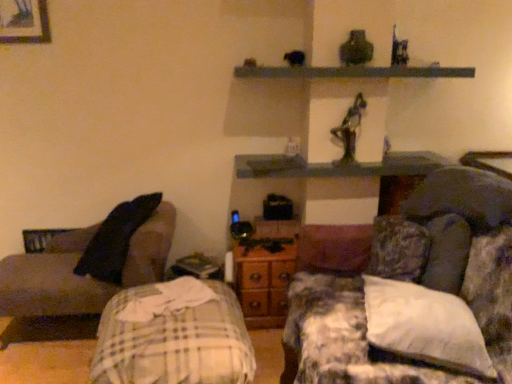
The image size is (512, 384). What do you see at coordinates (459, 247) in the screenshot?
I see `fluffy fabric couch at right, arranged as the 1th studio couch when viewed from the right` at bounding box center [459, 247].

The width and height of the screenshot is (512, 384). Describe the element at coordinates (173, 336) in the screenshot. I see `plaid fabric bed at lower left` at that location.

What is the approximate width of white soft pillow at right?

white soft pillow at right is 18.40 inches wide.

At what (x,y) coordinates should I click in order to perform the action: click on smooth gray shelf at upper center, which is the second shelf from bottom to top. Please return your answer as a coordinate pair (x, y). The height and width of the screenshot is (384, 512). Looking at the image, I should click on (352, 72).

Locate an element on the screen. wooden dresser at center is located at coordinates (265, 271).

Measure the distance between point (425, 157) and camera.

A distance of 2.70 meters exists between point (425, 157) and camera.

Identify the location of dark gray fabric couch at left, which is counted as the 2th studio couch, starting from the right. The image size is (512, 384). (79, 276).

In order to click on fluffy fabric couch at right, arranged as the 2th studio couch when viewed from the left in this screenshot , I will do `click(459, 247)`.

Where is `dresser on the left side of fluffy fabric couch at right, arranged as the 1th studio couch when viewed from the right`? This screenshot has width=512, height=384. dresser on the left side of fluffy fabric couch at right, arranged as the 1th studio couch when viewed from the right is located at coordinates (265, 271).

From the image's perspective, relative to wooden dresser at center, is fluffy fabric couch at right, arranged as the 1th studio couch when viewed from the right, above or below?

fluffy fabric couch at right, arranged as the 1th studio couch when viewed from the right, is situated lower than wooden dresser at center in the image.

Considering the sizes of objects fluffy fabric couch at right, arranged as the 2th studio couch when viewed from the left, and wooden dresser at center in the image provided, who is wider, fluffy fabric couch at right, arranged as the 2th studio couch when viewed from the left, or wooden dresser at center?

Wider between the two is fluffy fabric couch at right, arranged as the 2th studio couch when viewed from the left.

From a real-world perspective, between fluffy fabric couch at right, arranged as the 1th studio couch when viewed from the right, and wooden dresser at center, who is vertically lower?

wooden dresser at center is physically lower.

Based on their positions, is wooden shelf at center, acting as the 1th shelf starting from the bottom, located to the left or right of white soft pillow at right?

Based on their positions, wooden shelf at center, acting as the 1th shelf starting from the bottom, is located to the left of white soft pillow at right.

How different are the orientations of wooden shelf at center, acting as the 1th shelf starting from the bottom, and white soft pillow at right in degrees?

106 degrees.

Between wooden shelf at center, the 2th shelf viewed from the top, and white soft pillow at right, which one has more height?

Standing taller between the two is white soft pillow at right.

Which of these two, wooden shelf at center, acting as the 1th shelf starting from the bottom, or white soft pillow at right, is wider?

white soft pillow at right is wider.

Does fluffy fabric couch at right, arranged as the 1th studio couch when viewed from the right, have a larger size compared to wooden shelf at center, the 2th shelf viewed from the top?

Yes.

Which is farther from the camera, (337, 334) or (313, 171)?

Positioned behind is point (313, 171).

From a real-world perspective, is fluffy fabric couch at right, arranged as the 2th studio couch when viewed from the left, positioned above or below wooden shelf at center, the 2th shelf viewed from the top?

Clearly, from a real-world perspective, fluffy fabric couch at right, arranged as the 2th studio couch when viewed from the left, is below wooden shelf at center, the 2th shelf viewed from the top.

In the image, is wooden framed picture at upper left on the left side or the right side of plaid fabric bed at lower left?

wooden framed picture at upper left is to the left of plaid fabric bed at lower left.

Can you confirm if wooden framed picture at upper left is wider than plaid fabric bed at lower left?

No, wooden framed picture at upper left is not wider than plaid fabric bed at lower left.

Which object is closer to the camera, wooden framed picture at upper left or plaid fabric bed at lower left?

plaid fabric bed at lower left is closer to the camera.

Does smooth gray shelf at upper center, which is the second shelf from bottom to top, have a lesser height compared to plaid fabric bed at lower left?

Correct, smooth gray shelf at upper center, which is the second shelf from bottom to top, is not as tall as plaid fabric bed at lower left.

From the picture: Which object is thinner, smooth gray shelf at upper center, which is the second shelf from bottom to top, or plaid fabric bed at lower left?

With smaller width is smooth gray shelf at upper center, which is the second shelf from bottom to top.

In the image, there is a smooth gray shelf at upper center, which is the second shelf from bottom to top. Where is `bed frame below it (from a real-world perspective)`? The height and width of the screenshot is (384, 512). bed frame below it (from a real-world perspective) is located at coordinates (173, 336).

Which object is positioned more to the left, plaid fabric bed at lower left or smooth gray shelf at upper center, which is the second shelf from bottom to top?

Positioned to the left is plaid fabric bed at lower left.

Is plaid fabric bed at lower left positioned far away from smooth gray shelf at upper center, the 1th shelf positioned from the top?

Yes, plaid fabric bed at lower left and smooth gray shelf at upper center, the 1th shelf positioned from the top, are quite far apart.

Can you confirm if plaid fabric bed at lower left is thinner than smooth gray shelf at upper center, the 1th shelf positioned from the top?

Incorrect, the width of plaid fabric bed at lower left is not less than that of smooth gray shelf at upper center, the 1th shelf positioned from the top.

Which is closer, [440,314] or [412,235]?

Point [440,314].

Can you confirm if white soft pillow at right is thinner than fluffy fabric couch at right, arranged as the 1th studio couch when viewed from the right?

Yes.

Consider the image. From the image's perspective, who appears lower, white soft pillow at right or fluffy fabric couch at right, arranged as the 1th studio couch when viewed from the right?

fluffy fabric couch at right, arranged as the 1th studio couch when viewed from the right, from the image's perspective.

This screenshot has width=512, height=384. Identify the location of studio couch below the wooden dresser at center (from the image's perspective). (459, 247).

Identify the location of pillow in front of the wooden shelf at center, acting as the 1th shelf starting from the bottom. Image resolution: width=512 pixels, height=384 pixels. (425, 326).

Looking at the image, which one is located closer to smooth gray shelf at upper center, which is the second shelf from bottom to top, white soft pillow at right or wooden shelf at center, the 2th shelf viewed from the top?

wooden shelf at center, the 2th shelf viewed from the top, is closer to smooth gray shelf at upper center, which is the second shelf from bottom to top.

Considering their positions, is plaid fabric bed at lower left positioned closer to smooth gray shelf at upper center, the 1th shelf positioned from the top, than fluffy fabric couch at right, arranged as the 2th studio couch when viewed from the left?

The object closer to smooth gray shelf at upper center, the 1th shelf positioned from the top, is fluffy fabric couch at right, arranged as the 2th studio couch when viewed from the left.

Looking at this image, based on their spatial positions, is white soft pillow at right or plaid fabric bed at lower left further from fluffy fabric couch at right, arranged as the 2th studio couch when viewed from the left?

The object further to fluffy fabric couch at right, arranged as the 2th studio couch when viewed from the left, is plaid fabric bed at lower left.

Looking at the image, which one is located closer to fluffy fabric couch at right, arranged as the 2th studio couch when viewed from the left, wooden dresser at center or smooth gray shelf at upper center, which is the second shelf from bottom to top?

wooden dresser at center.

Looking at the image, which one is located closer to white soft pillow at right, smooth gray shelf at upper center, which is the second shelf from bottom to top, or wooden dresser at center?

wooden dresser at center is positioned closer to the anchor white soft pillow at right.

Based on the photo, when comparing their distances from wooden framed picture at upper left, does plaid fabric bed at lower left or white soft pillow at right seem further?

The object further to wooden framed picture at upper left is white soft pillow at right.

From the picture: Based on their spatial positions, is dark gray fabric couch at left, the 1th studio couch viewed from the left, or white soft pillow at right further from wooden dresser at center?

white soft pillow at right.

Estimate the real-world distances between objects in this image. Which object is further from fluffy fabric couch at right, arranged as the 2th studio couch when viewed from the left, smooth gray shelf at upper center, the 1th shelf positioned from the top, or wooden shelf at center, the 2th shelf viewed from the top?

Among the two, smooth gray shelf at upper center, the 1th shelf positioned from the top, is located further to fluffy fabric couch at right, arranged as the 2th studio couch when viewed from the left.

Locate an element on the screen. This screenshot has height=384, width=512. bed frame between dark gray fabric couch at left, which is counted as the 2th studio couch, starting from the right, and fluffy fabric couch at right, arranged as the 1th studio couch when viewed from the right, from left to right is located at coordinates click(173, 336).

Where is `shelf situated between wooden framed picture at upper left and wooden shelf at center, the 2th shelf viewed from the top, from left to right`? The width and height of the screenshot is (512, 384). shelf situated between wooden framed picture at upper left and wooden shelf at center, the 2th shelf viewed from the top, from left to right is located at coordinates (352, 72).

Locate an element on the screen. The width and height of the screenshot is (512, 384). pillow situated between dark gray fabric couch at left, which is counted as the 2th studio couch, starting from the right, and fluffy fabric couch at right, arranged as the 1th studio couch when viewed from the right, from left to right is located at coordinates (425, 326).

The width and height of the screenshot is (512, 384). Identify the location of pillow between wooden framed picture at upper left and fluffy fabric couch at right, arranged as the 1th studio couch when viewed from the right, in the horizontal direction. (425, 326).